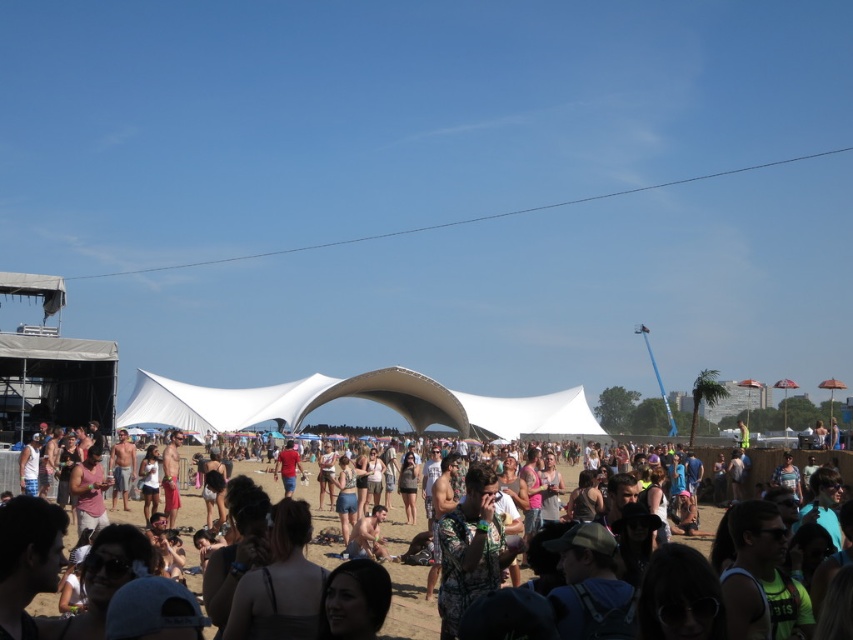
Does white fabric canopy at center have a lesser height compared to floral print shirt at center?

No.

Describe the element at coordinates (358, 397) in the screenshot. I see `white fabric canopy at center` at that location.

Image resolution: width=853 pixels, height=640 pixels. I want to click on white fabric canopy at center, so click(358, 397).